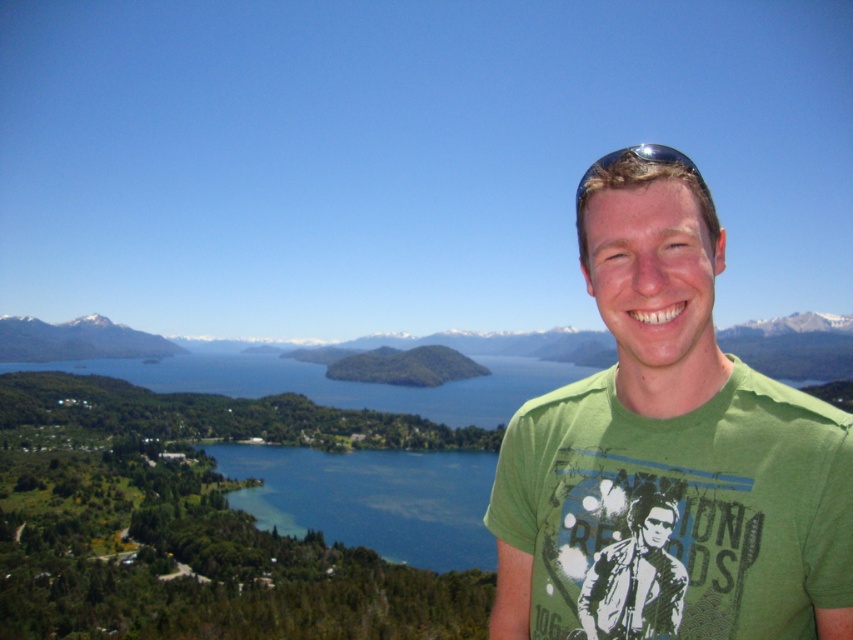
Can you confirm if green cotton t-shirt at center is thinner than metallic reflective sunglasses at upper right?

Indeed, green cotton t-shirt at center has a lesser width compared to metallic reflective sunglasses at upper right.

Does green cotton t-shirt at center have a greater height compared to metallic reflective sunglasses at upper right?

Incorrect, green cotton t-shirt at center's height is not larger of metallic reflective sunglasses at upper right's.

Image resolution: width=853 pixels, height=640 pixels. Describe the element at coordinates (668, 451) in the screenshot. I see `green cotton t-shirt at center` at that location.

Identify the location of green cotton t-shirt at center. This screenshot has width=853, height=640. pyautogui.click(x=668, y=451).

Consider the image. Which of these two, snowy rock mountain at left or metallic reflective sunglasses at upper right, stands taller?

metallic reflective sunglasses at upper right is taller.

Which is below, snowy rock mountain at left or metallic reflective sunglasses at upper right?

snowy rock mountain at left

Where is `snowy rock mountain at left`? snowy rock mountain at left is located at coordinates (76, 340).

Who is more forward, (701, 545) or (662, 550)?

Point (701, 545) is more forward.

Consider the image. Measure the distance between green cotton t-shirt at center and camera.

green cotton t-shirt at center is 30.47 meters away from camera.

Who is more distant from viewer, (637, 550) or (674, 621)?

The point (637, 550) is behind.

The width and height of the screenshot is (853, 640). In order to click on green cotton t-shirt at center in this screenshot , I will do `click(668, 451)`.